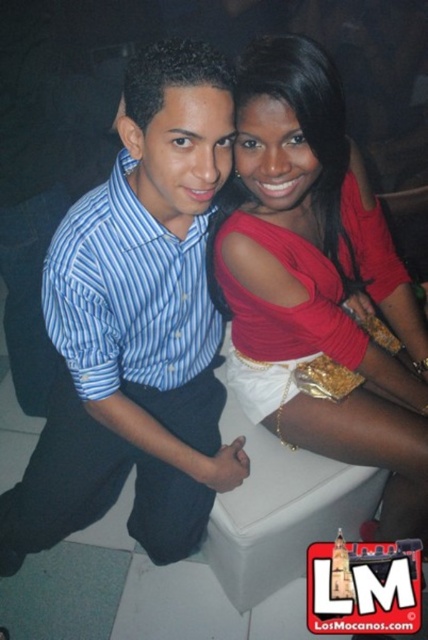
Question: Which of the following is the farthest from the observer?

Choices:
 (A) (391, 317)
 (B) (107, 179)

Answer: (A)

Question: Among these points, which one is nearest to the camera?

Choices:
 (A) (418, 529)
 (B) (109, 188)

Answer: (B)

Question: Is matte red blouse at center to the right of blue striped shirt at left from the viewer's perspective?

Choices:
 (A) no
 (B) yes

Answer: (B)

Question: Does matte red blouse at center come in front of blue striped shirt at left?

Choices:
 (A) no
 (B) yes

Answer: (B)

Question: Where is matte red blouse at center located in relation to blue striped shirt at left in the image?

Choices:
 (A) below
 (B) above

Answer: (A)